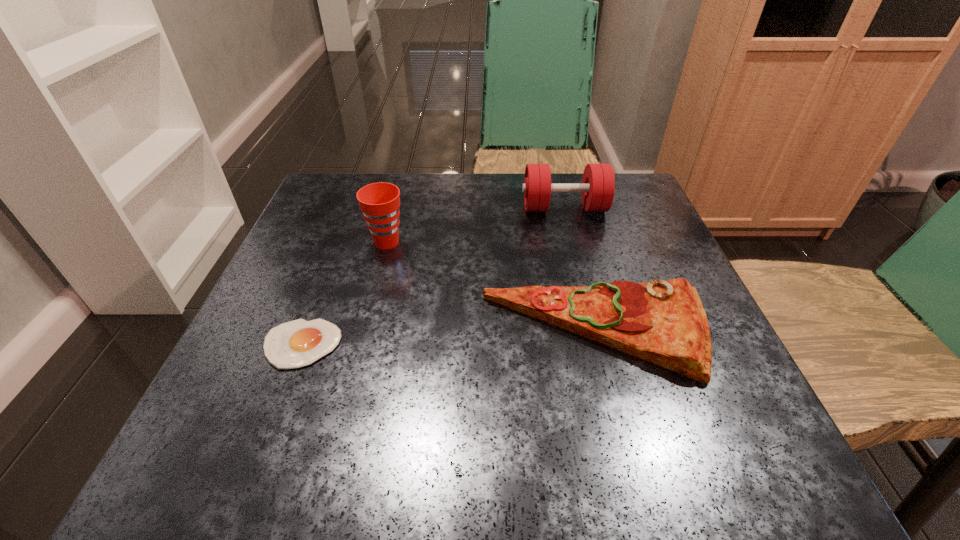
The height and width of the screenshot is (540, 960). I want to click on the second farthest object, so click(379, 202).

At what (x,y) coordinates should I click in order to perform the action: click on dumbbell. Please return your answer as a coordinate pair (x, y). Looking at the image, I should click on (598, 183).

In order to click on pizza in this screenshot , I will do `click(663, 322)`.

You are a GUI agent. You are given a task and a screenshot of the screen. Output one action in this format:
    pyautogui.click(x=<x>, y=<y>)
    Task: Click on the shortest object
    This screenshot has height=540, width=960.
    Given the screenshot: What is the action you would take?
    pyautogui.click(x=298, y=343)

You are a GUI agent. You are given a task and a screenshot of the screen. Output one action in this format:
    pyautogui.click(x=<x>, y=<y>)
    Task: Click on the free location located 0.320m on the right of the second farthest object
    The image size is (960, 540).
    Given the screenshot: What is the action you would take?
    pyautogui.click(x=563, y=242)

I want to click on vacant position located 0.290m on the front of the farthest object, so click(x=593, y=320).

Identify the location of blank space located on the front of the pizza. This screenshot has width=960, height=540. click(x=627, y=443).

The height and width of the screenshot is (540, 960). In order to click on blank space located on the right of the egg yolk in this screenshot , I will do `click(403, 344)`.

Identify the location of cup located at the far edge. The image size is (960, 540). (379, 202).

Identify the location of dumbbell located in the far edge section of the desktop. The image size is (960, 540). click(598, 183).